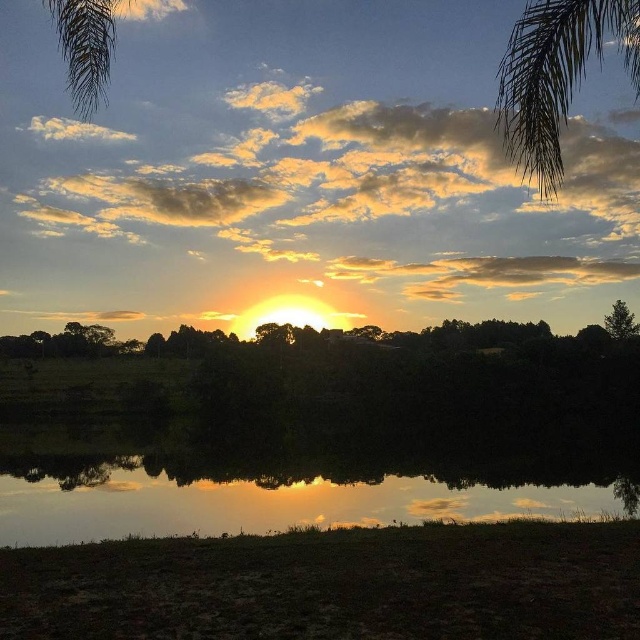
Question: Which point is farther to the camera?

Choices:
 (A) (616, 324)
 (B) (83, 19)

Answer: (A)

Question: Among these points, which one is farthest from the camera?

Choices:
 (A) (564, 35)
 (B) (611, 316)
 (C) (342, 458)
 (D) (90, 86)

Answer: (B)

Question: Is glossy reflective water at center smaller than green leafy tree at right?

Choices:
 (A) yes
 (B) no

Answer: (B)

Question: Can you confirm if green leafy palm tree at upper right is bigger than green leafy tree at right?

Choices:
 (A) yes
 (B) no

Answer: (A)

Question: Which object is farther from the camera taking this photo?

Choices:
 (A) green leafy tree at right
 (B) glossy reflective water at center
 (C) green leafy palm tree at upper left
 (D) green leafy palm tree at upper right

Answer: (A)

Question: Is green leafy palm tree at upper right above green leafy tree at right?

Choices:
 (A) yes
 (B) no

Answer: (A)